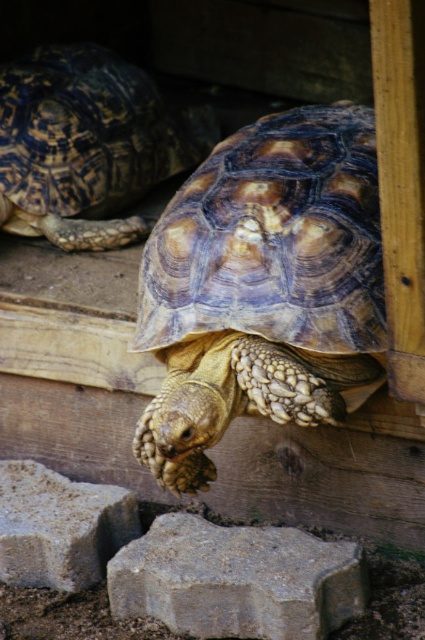
What do you see at coordinates (263, 288) in the screenshot? The width and height of the screenshot is (425, 640). I see `brown textured shell at center` at bounding box center [263, 288].

You are a GUI agent. You are given a task and a screenshot of the screen. Output one action in this format:
    pyautogui.click(x=<x>, y=<y>)
    Task: Click on the brown textured shell at center
    This screenshot has height=640, width=425.
    Given the screenshot: What is the action you would take?
    pyautogui.click(x=263, y=288)

Locate an element on the screen. The width and height of the screenshot is (425, 640). brown textured shell at center is located at coordinates (263, 288).

Between point (249, 611) and point (122, 504), which one is positioned in front?

Point (249, 611)

Is gray rough stone at lower center to the left of gray textured stone at lower left from the viewer's perspective?

Incorrect, gray rough stone at lower center is not on the left side of gray textured stone at lower left.

Image resolution: width=425 pixels, height=640 pixels. What do you see at coordinates (237, 579) in the screenshot?
I see `gray rough stone at lower center` at bounding box center [237, 579].

Find the location of a particular element. gray rough stone at lower center is located at coordinates (237, 579).

Which is more to the right, shiny brown tortoise at upper left or gray textured stone at lower left?

From the viewer's perspective, gray textured stone at lower left appears more on the right side.

Looking at this image, which is more to the left, shiny brown tortoise at upper left or gray textured stone at lower left?

Positioned to the left is shiny brown tortoise at upper left.

Is point (33, 221) more distant than point (113, 554)?

Yes, point (33, 221) is farther from viewer.

Where is `shiny brown tortoise at upper left`? shiny brown tortoise at upper left is located at coordinates (87, 145).